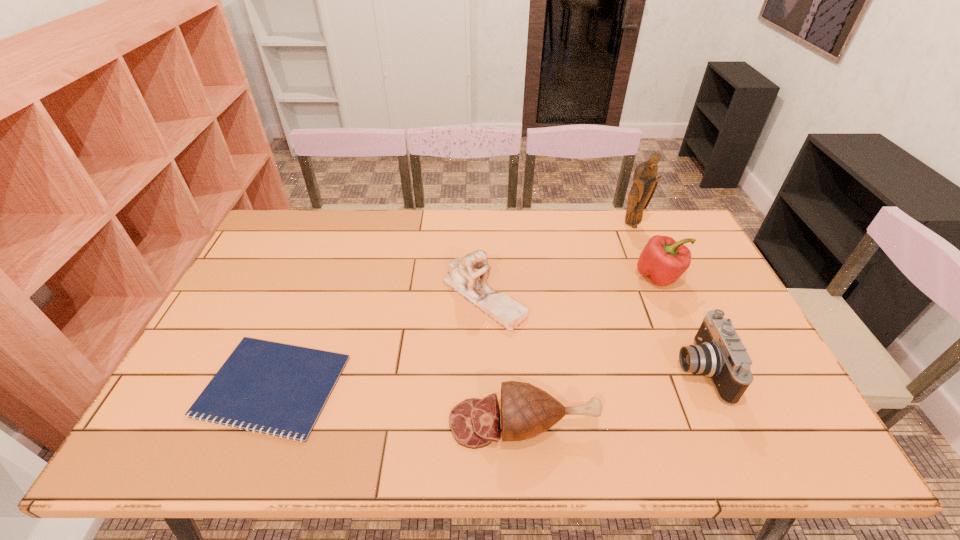
Find the location of `vacant space situated 0.220m on the front-facing side of the nearer figurine`. vacant space situated 0.220m on the front-facing side of the nearer figurine is located at coordinates (485, 402).

You are a GUI agent. You are given a task and a screenshot of the screen. Output one action in this format:
    pyautogui.click(x=<x>, y=<y>)
    Task: Click on the free space located 0.100m on the back of the bell pepper
    This screenshot has width=960, height=540.
    Given the screenshot: What is the action you would take?
    pyautogui.click(x=644, y=241)

Locate an element on the screen. This screenshot has height=540, width=960. vacant region located on the front-facing side of the camera is located at coordinates (567, 369).

Identify the location of vacant space located on the front-facing side of the camera. The image size is (960, 540). (529, 369).

Locate an element on the screen. vacant space located on the front-facing side of the camera is located at coordinates (588, 369).

Where is `free region located at the sliced end of the fifth tallest object`? free region located at the sliced end of the fifth tallest object is located at coordinates (375, 422).

At what (x,y) coordinates should I click in order to perform the action: click on free location located 0.380m at the sliced end of the fifth tallest object. Please return your answer as a coordinate pair (x, y). Looking at the image, I should click on (285, 422).

You are a GUI agent. You are given a task and a screenshot of the screen. Output one action in this format:
    pyautogui.click(x=<x>, y=<y>)
    Task: Click on the free space located 0.170m at the sliced end of the fifth tallest object
    The width and height of the screenshot is (960, 540).
    Given the screenshot: What is the action you would take?
    pyautogui.click(x=375, y=422)

This screenshot has width=960, height=540. I want to click on free space located on the back of the notepad, so click(x=302, y=312).

Where is `object located in the far edge section of the desktop`? Image resolution: width=960 pixels, height=540 pixels. object located in the far edge section of the desktop is located at coordinates (645, 182).